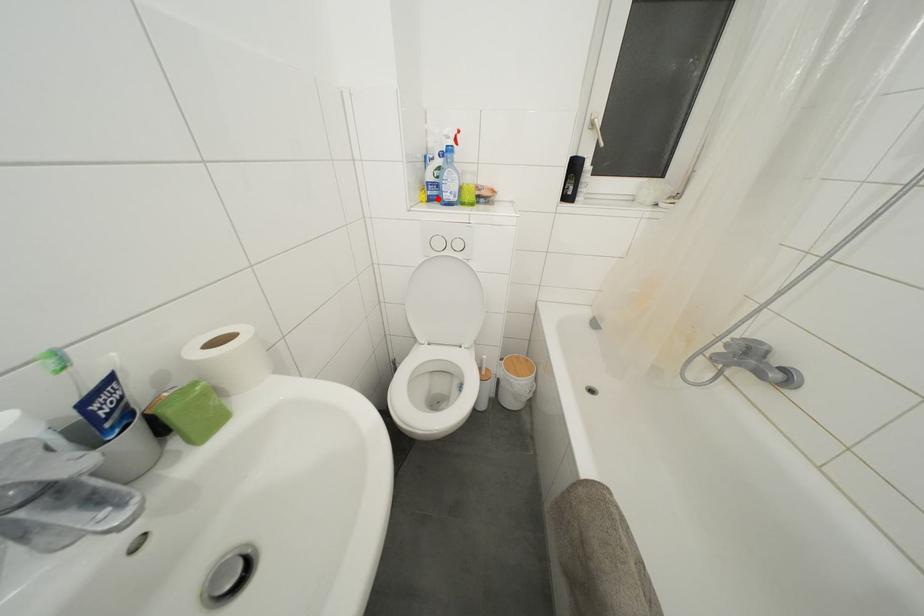
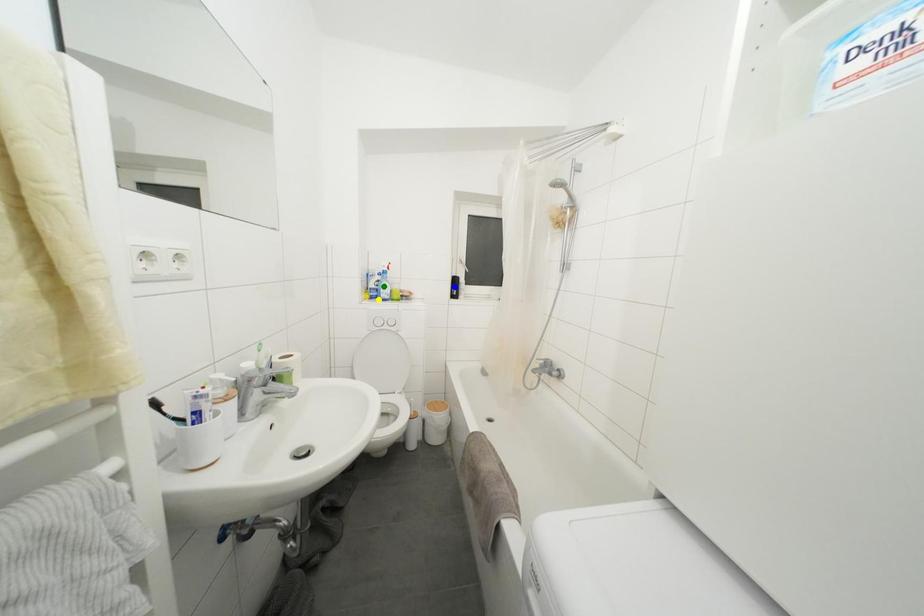
Question: I am providing you with two images of the same scene from different viewpoints. A red point is marked on the first image. You are given multiple points on the second image. Which spot in image 2 lines up with the point in image 1?

Choices:
 (A) blue point
 (B) yellow point
 (C) green point

Answer: (B)